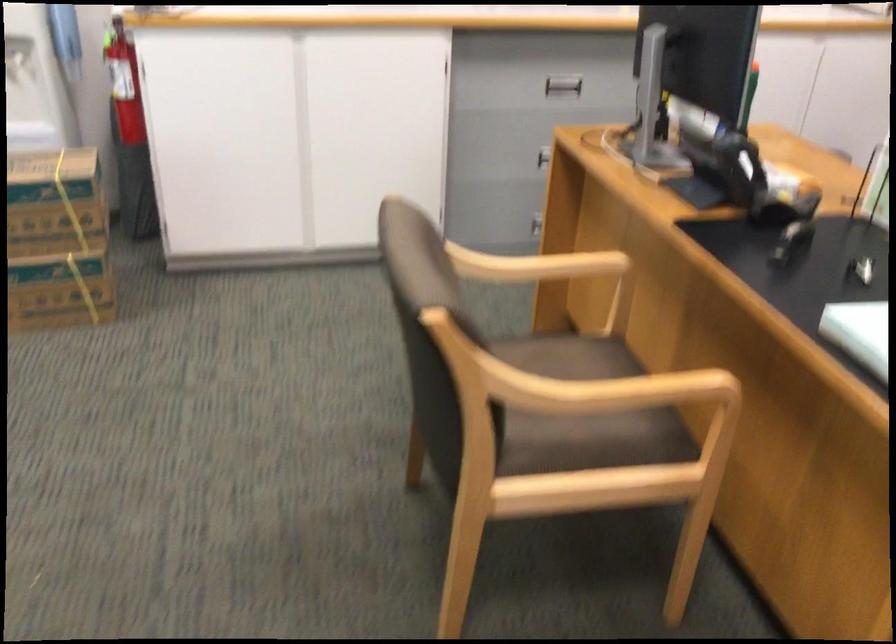
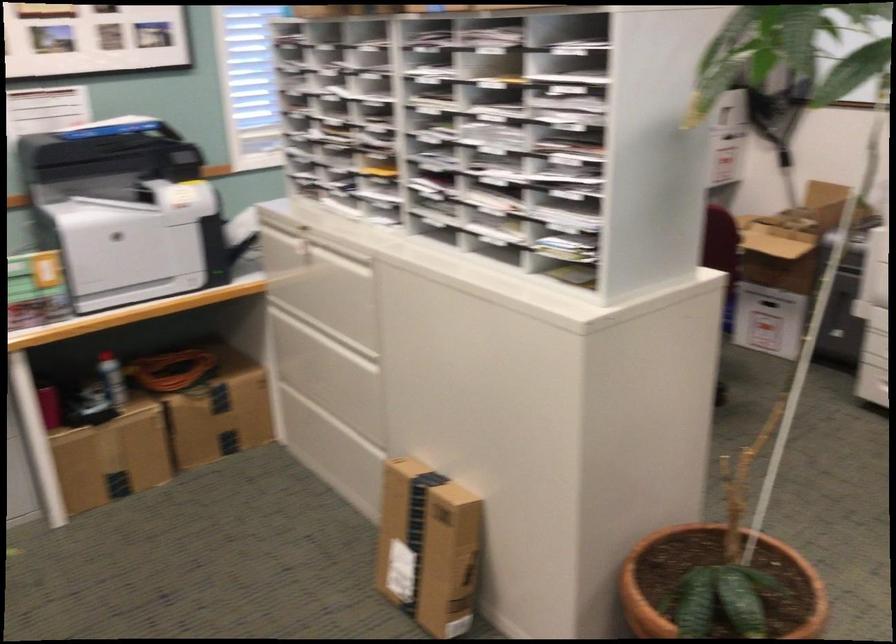
Based on the continuous images, in which direction is the camera rotating?

The camera rotated toward right-down.